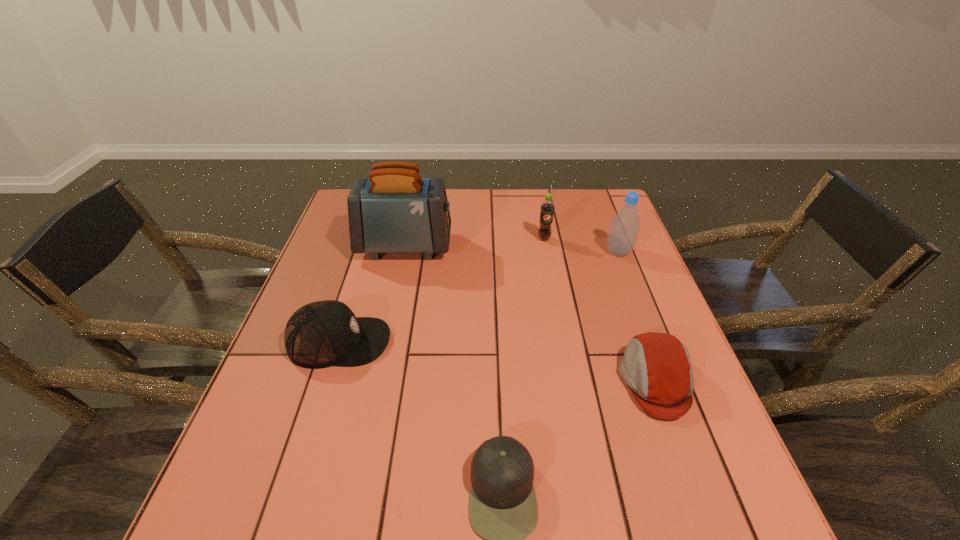
Find the location of a particular element. The image size is (960, 540). vacant space at the left edge of the desktop is located at coordinates (331, 256).

Where is `vacant space at the right edge of the desktop`? The image size is (960, 540). vacant space at the right edge of the desktop is located at coordinates (663, 306).

Locate an element on the screen. vacant region at the far right corner of the desktop is located at coordinates (614, 213).

Locate an element on the screen. Image resolution: width=960 pixels, height=540 pixels. vacant space in between the fourth shortest object and the rightmost cap is located at coordinates (600, 310).

This screenshot has height=540, width=960. In order to click on free space between the soda and the rightmost cap in this screenshot , I will do `click(600, 310)`.

Identify the location of vacant region between the bottle and the rightmost cap. (637, 316).

Find the location of `free space between the tallest object and the fourth shortest object`. free space between the tallest object and the fourth shortest object is located at coordinates (474, 242).

Identify the location of free space between the rightmost cap and the fifth shortest object. The image size is (960, 540). (637, 316).

The image size is (960, 540). In order to click on vacant space that is in between the tallest object and the rightmost cap in this screenshot , I will do `click(530, 314)`.

Where is `vacant space that's between the second tallest object and the third tallest object`? The height and width of the screenshot is (540, 960). vacant space that's between the second tallest object and the third tallest object is located at coordinates (582, 245).